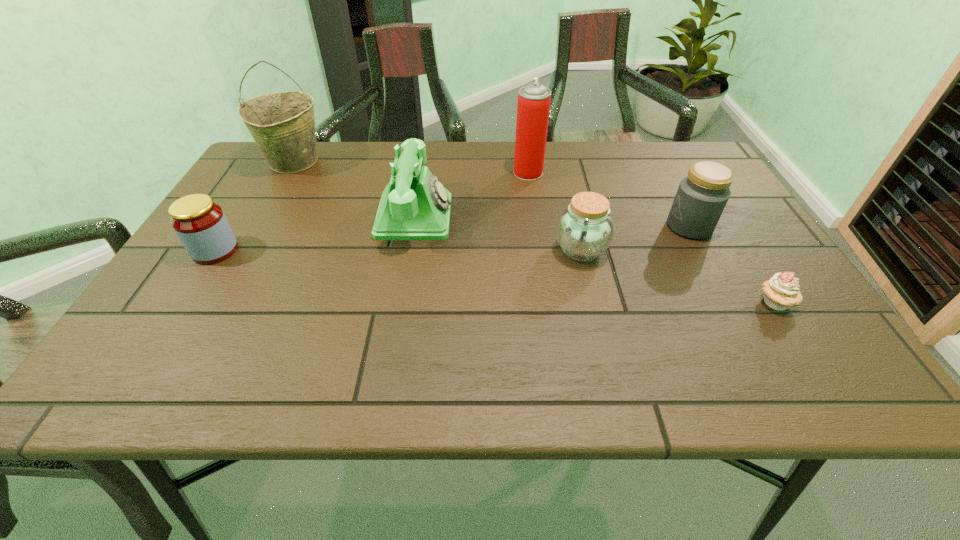
Where is `jar located at the left edge`? Image resolution: width=960 pixels, height=540 pixels. jar located at the left edge is located at coordinates (200, 224).

Locate an element on the screen. jar that is at the right edge is located at coordinates (701, 197).

At what (x,y) coordinates should I click in order to perform the action: click on cupcake present at the right edge. Please return your answer as a coordinate pair (x, y). Looking at the image, I should click on (780, 292).

Identify the location of object present at the far left corner. The width and height of the screenshot is (960, 540). (282, 124).

In the image, there is a desktop. Find the location of `vacant space at the far edge`. vacant space at the far edge is located at coordinates (367, 159).

Where is `vacant region at the left edge of the desktop`? Image resolution: width=960 pixels, height=540 pixels. vacant region at the left edge of the desktop is located at coordinates (193, 265).

Locate an element on the screen. The width and height of the screenshot is (960, 540). free region at the right edge of the desktop is located at coordinates (773, 271).

In the image, there is a desktop. Where is `vacant space at the far left corner`? vacant space at the far left corner is located at coordinates (237, 184).

Identify the location of vacant region between the wine bucket and the rightmost object. (535, 232).

Where is `vacant space that's between the telephone and the cupcake`? The width and height of the screenshot is (960, 540). vacant space that's between the telephone and the cupcake is located at coordinates (595, 260).